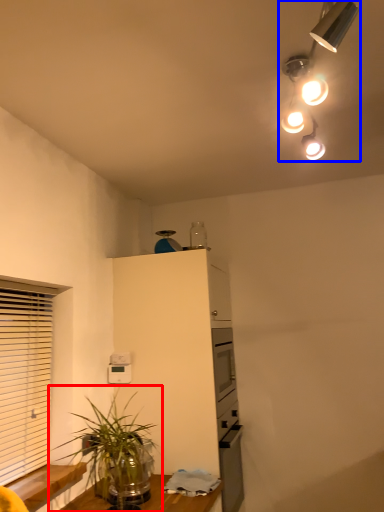
Question: Which point is closer to the camera, houseplant (highlighted by a red box) or lamp (highlighted by a blue box)?

Choices:
 (A) houseplant
 (B) lamp

Answer: (B)